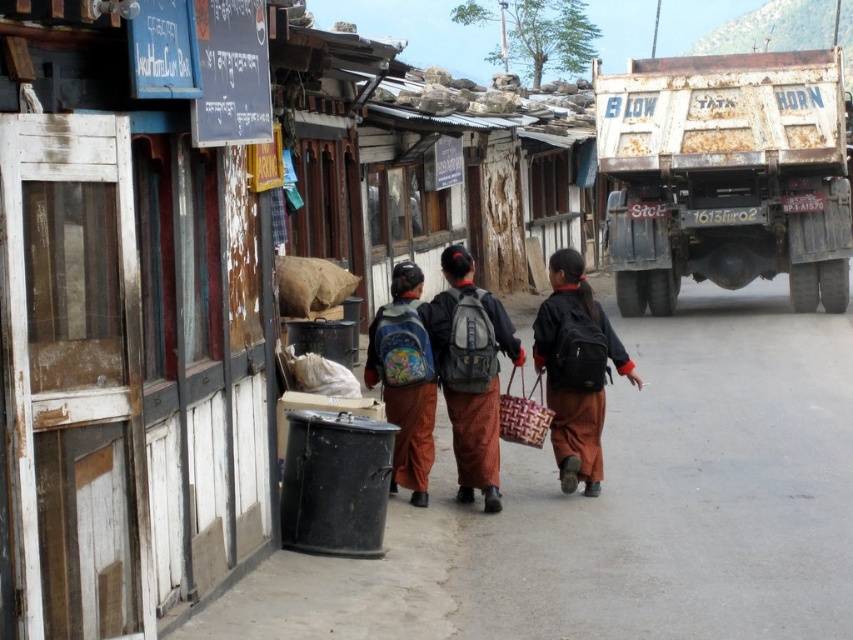
Identify the location of brown fabric at center. The image size is (853, 640). (622, 508).

Who is more distant from viewer, (647, 420) or (791, 252)?

Positioned behind is point (791, 252).

Does point (781, 337) lie in front of point (827, 120)?

No, (781, 337) is behind (827, 120).

The width and height of the screenshot is (853, 640). Find the location of `brown fabric at center`. brown fabric at center is located at coordinates (622, 508).

Who is more forward, (618,81) or (389,349)?

Point (389,349)

Does point (720, 131) come behind point (401, 401)?

Yes, it is.

What are the coordinates of `rusty metal truck at right` in the screenshot? It's located at (727, 176).

From the picture: Is matte black backpacks at center further to the viewer compared to black fabric backpack at center?

No, it is not.

Can you confirm if matte black backpacks at center is positioned below black fabric backpack at center?

Indeed, matte black backpacks at center is positioned under black fabric backpack at center.

Is point (479, 448) positioned in front of point (572, 388)?

That is True.

The width and height of the screenshot is (853, 640). I want to click on matte black backpacks at center, so click(445, 378).